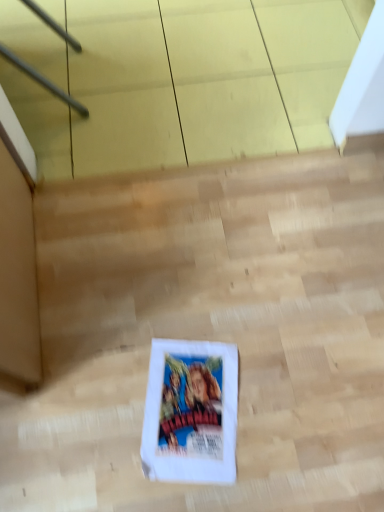
Question: Does white paper bag at center have a greater height compared to white paper comic book at center?

Choices:
 (A) yes
 (B) no

Answer: (A)

Question: Is the position of white paper bag at center less distant than that of white paper comic book at center?

Choices:
 (A) yes
 (B) no

Answer: (A)

Question: Considering the relative positions of white paper bag at center and white paper comic book at center in the image provided, is white paper bag at center to the right of white paper comic book at center from the viewer's perspective?

Choices:
 (A) no
 (B) yes

Answer: (B)

Question: Is white paper bag at center not near white paper comic book at center?

Choices:
 (A) yes
 (B) no

Answer: (B)

Question: From the image's perspective, is white paper bag at center located beneath white paper comic book at center?

Choices:
 (A) yes
 (B) no

Answer: (B)

Question: Is white paper bag at center oriented away from white paper comic book at center?

Choices:
 (A) no
 (B) yes

Answer: (B)

Question: Would you say white paper comic book at center contains white paper bag at center?

Choices:
 (A) yes
 (B) no

Answer: (B)

Question: Is white paper comic book at center closer to the viewer compared to white paper bag at center?

Choices:
 (A) no
 (B) yes

Answer: (A)

Question: Is white paper comic book at center to the right of white paper bag at center from the viewer's perspective?

Choices:
 (A) no
 (B) yes

Answer: (A)

Question: Can you confirm if white paper comic book at center is thinner than white paper bag at center?

Choices:
 (A) yes
 (B) no

Answer: (A)

Question: Could you tell me if white paper comic book at center is turned towards white paper bag at center?

Choices:
 (A) no
 (B) yes

Answer: (B)

Question: Is white paper comic book at center facing away from white paper bag at center?

Choices:
 (A) yes
 (B) no

Answer: (A)

Question: Considering the positions of point (180, 352) and point (168, 285), is point (180, 352) closer or farther from the camera than point (168, 285)?

Choices:
 (A) closer
 (B) farther

Answer: (A)